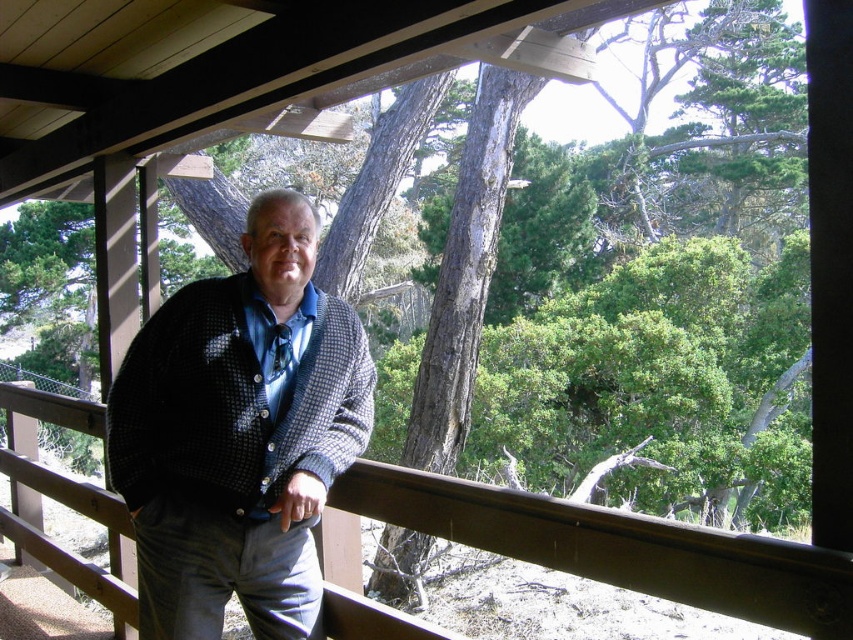
Question: Which of the following is the closest to the observer?

Choices:
 (A) coord(287,589)
 (B) coord(419,504)

Answer: (B)

Question: Among these objects, which one is nearest to the camera?

Choices:
 (A) brown wooden rail at center
 (B) knitted sweater at center

Answer: (B)

Question: Is knitted sweater at center closer to camera compared to brown wooden rail at center?

Choices:
 (A) yes
 (B) no

Answer: (A)

Question: Considering the relative positions of knitted sweater at center and brown wooden rail at center in the image provided, where is knitted sweater at center located with respect to brown wooden rail at center?

Choices:
 (A) below
 (B) above

Answer: (B)

Question: Which point is closer to the camera?

Choices:
 (A) knitted sweater at center
 (B) brown wooden rail at center

Answer: (A)

Question: Is knitted sweater at center to the right of brown wooden rail at center from the viewer's perspective?

Choices:
 (A) yes
 (B) no

Answer: (A)